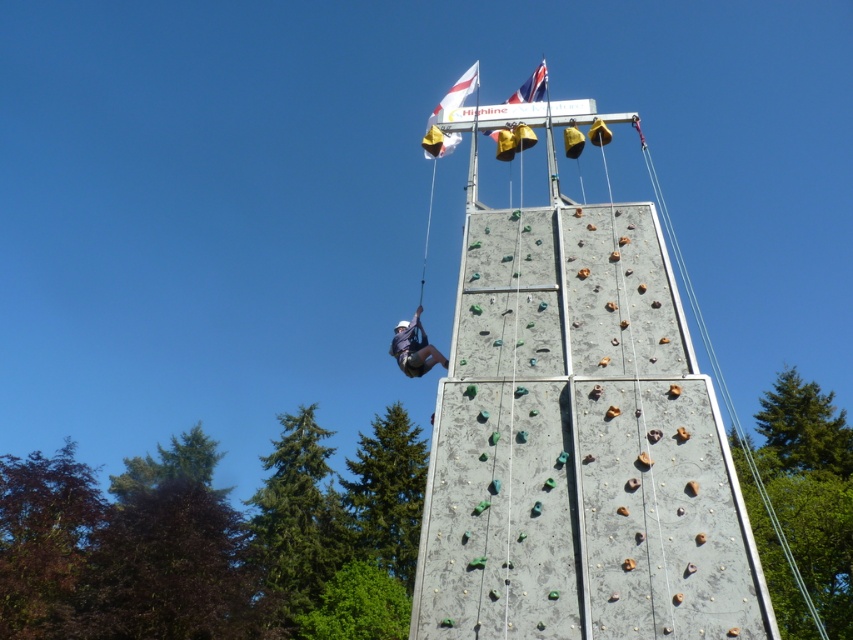
Question: Is white fabric flag at upper center positioned at the back of british flag at top?

Choices:
 (A) no
 (B) yes

Answer: (B)

Question: Does white fabric flag at upper center come behind british flag at top?

Choices:
 (A) yes
 (B) no

Answer: (A)

Question: Is concrete climbing wall at center above white fabric flag at upper center?

Choices:
 (A) yes
 (B) no

Answer: (B)

Question: Among these points, which one is nearest to the camera?

Choices:
 (A) (567, 588)
 (B) (450, 141)

Answer: (A)

Question: Which of the following is the closest to the observer?

Choices:
 (A) white fabric flag at upper center
 (B) concrete climbing wall at center

Answer: (B)

Question: Which of the following is the closest to the observer?

Choices:
 (A) white fabric flag at upper center
 (B) british flag at top
 (C) white fabric helmet at upper center
 (D) concrete climbing wall at center

Answer: (D)